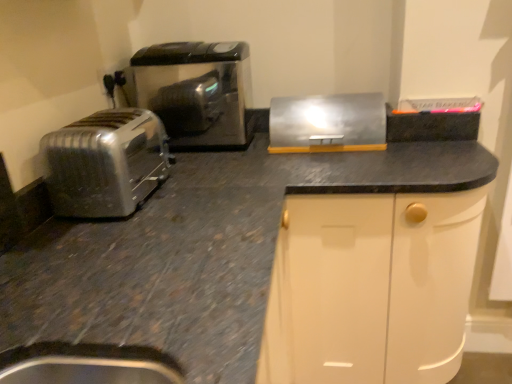
Question: Visually, is matte black outlet at upper left positioned to the left or to the right of metallic silver breadbox at upper right?

Choices:
 (A) right
 (B) left

Answer: (B)

Question: Considering the positions of matte black outlet at upper left and metallic silver breadbox at upper right in the image, is matte black outlet at upper left bigger or smaller than metallic silver breadbox at upper right?

Choices:
 (A) big
 (B) small

Answer: (B)

Question: Estimate the real-world distances between objects in this image. Which object is closer to the metallic silver breadbox at upper right?

Choices:
 (A) satin silver toaster at left
 (B) satin black toaster at left
 (C) matte black outlet at upper left

Answer: (B)

Question: Which of these objects is positioned closest to the metallic silver breadbox at upper right?

Choices:
 (A) satin black toaster at left
 (B) matte black outlet at upper left
 (C) satin silver toaster at left

Answer: (A)